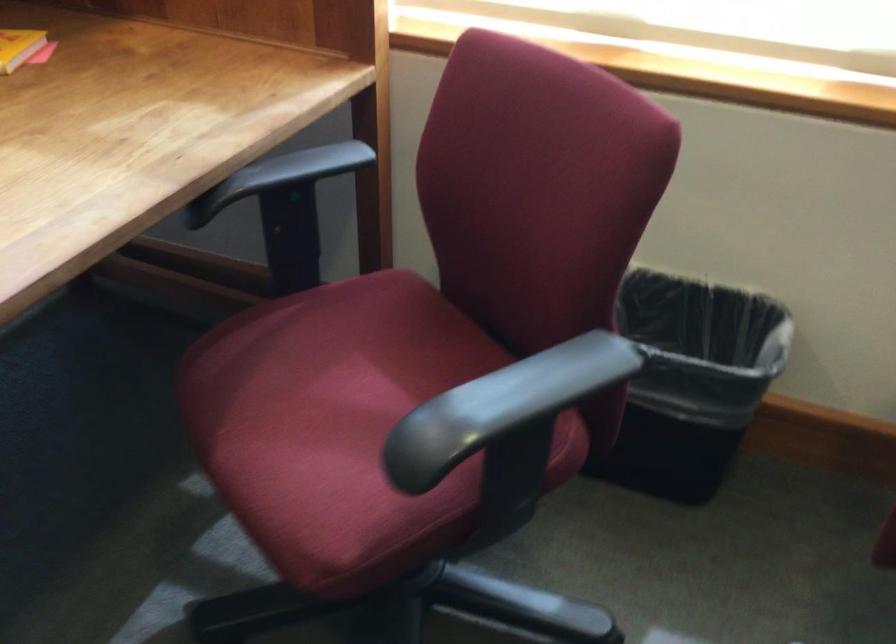
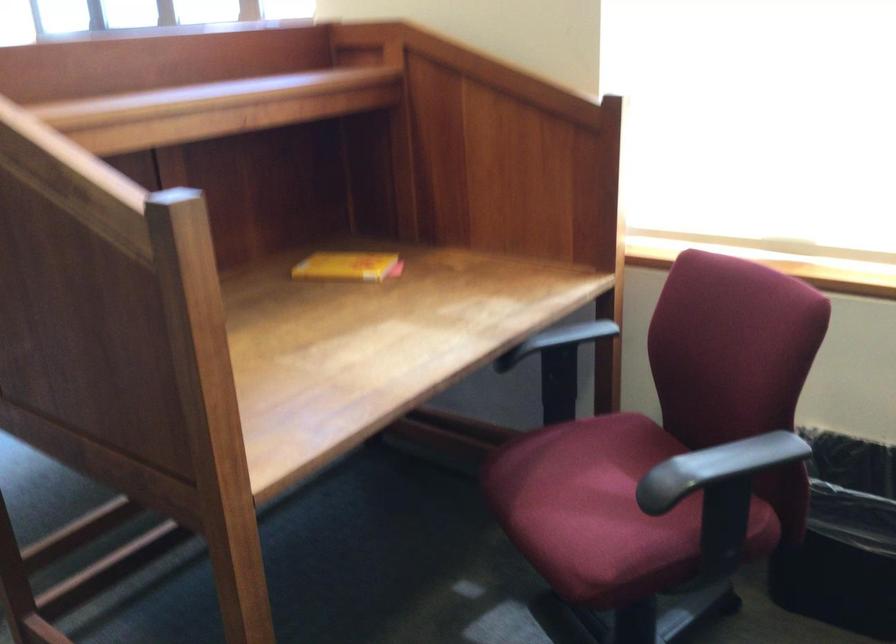
Where in the second image is the point corresponding to the point at 501,410 from the first image?

(716, 468)